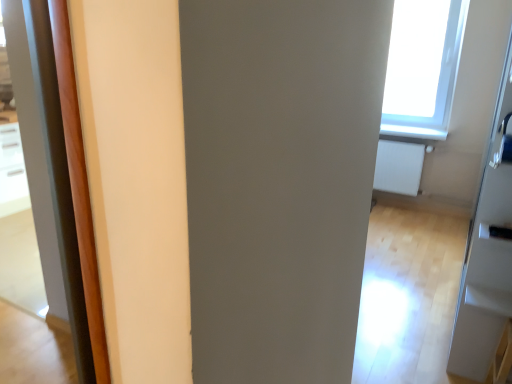
Question: Is transparent glass screen door at upper right located outside black plastic door handle at lower right, the second door handle viewed from the top?

Choices:
 (A) no
 (B) yes

Answer: (B)

Question: Is transparent glass screen door at upper right oriented away from black plastic door handle at lower right, the second door handle viewed from the top?

Choices:
 (A) no
 (B) yes

Answer: (B)

Question: Is transparent glass screen door at upper right far away from black plastic door handle at lower right, the 1th door handle in the bottom-to-top sequence?

Choices:
 (A) no
 (B) yes

Answer: (A)

Question: Is transparent glass screen door at upper right thinner than black plastic door handle at lower right, the 1th door handle in the bottom-to-top sequence?

Choices:
 (A) no
 (B) yes

Answer: (A)

Question: From a real-world perspective, is transparent glass screen door at upper right physically above black plastic door handle at lower right, the 1th door handle in the bottom-to-top sequence?

Choices:
 (A) no
 (B) yes

Answer: (B)

Question: Is transparent glass screen door at upper right behind black plastic door handle at lower right, the 1th door handle in the bottom-to-top sequence?

Choices:
 (A) yes
 (B) no

Answer: (B)

Question: Is black plastic door handle at lower right, the 1th door handle in the bottom-to-top sequence, at the left side of transparent glass screen door at upper right?

Choices:
 (A) yes
 (B) no

Answer: (A)

Question: Are black plastic door handle at lower right, the 1th door handle in the bottom-to-top sequence, and transparent glass screen door at upper right making contact?

Choices:
 (A) no
 (B) yes

Answer: (A)

Question: Can you confirm if black plastic door handle at lower right, the second door handle viewed from the top, is wider than transparent glass screen door at upper right?

Choices:
 (A) no
 (B) yes

Answer: (A)

Question: Considering the relative sizes of black plastic door handle at lower right, the second door handle viewed from the top, and transparent glass screen door at upper right in the image provided, is black plastic door handle at lower right, the second door handle viewed from the top, shorter than transparent glass screen door at upper right?

Choices:
 (A) yes
 (B) no

Answer: (A)

Question: Does black plastic door handle at lower right, the second door handle viewed from the top, come behind transparent glass screen door at upper right?

Choices:
 (A) yes
 (B) no

Answer: (A)

Question: From a real-world perspective, is black plastic door handle at lower right, the second door handle viewed from the top, located higher than transparent glass screen door at upper right?

Choices:
 (A) yes
 (B) no

Answer: (B)

Question: Can you confirm if white matte radiator at right is wider than transparent glass screen door at upper right?

Choices:
 (A) yes
 (B) no

Answer: (A)